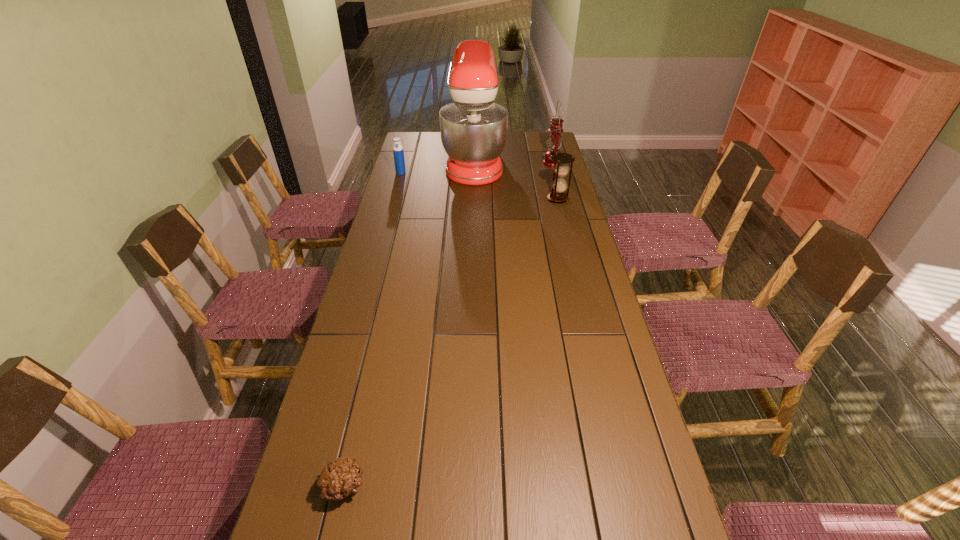
You are a GUI agent. You are given a task and a screenshot of the screen. Output one action in this format:
    pyautogui.click(x=<x>, y=<y>)
    Task: Click on the vacant space located 0.350m on the right of the water bottle
    This screenshot has width=960, height=540.
    Given the screenshot: What is the action you would take?
    pyautogui.click(x=476, y=173)

Find the location of `vacant space situated on the right of the muffin`. vacant space situated on the right of the muffin is located at coordinates (456, 487).

Identify the location of object that is at the far edge. The width and height of the screenshot is (960, 540). (473, 128).

You are a GUI agent. You are given a task and a screenshot of the screen. Output one action in this format:
    pyautogui.click(x=<x>, y=<y>)
    Task: Click on the water bottle positioned at the left edge
    
    Given the screenshot: What is the action you would take?
    pyautogui.click(x=398, y=152)

Find the location of `muffin located in the left edge section of the desktop`. muffin located in the left edge section of the desktop is located at coordinates (340, 478).

Image resolution: width=960 pixels, height=540 pixels. I want to click on oil lamp located at the right edge, so click(555, 139).

Where is `hourglass that is at the right edge`? hourglass that is at the right edge is located at coordinates 559,185.

Where is `vacant space at the left edge of the desktop`? The height and width of the screenshot is (540, 960). vacant space at the left edge of the desktop is located at coordinates (411, 200).

You are a GUI agent. You are given a task and a screenshot of the screen. Output one action in this format:
    pyautogui.click(x=<x>, y=<y>)
    Task: Click on the vacant region at the right edge of the desktop
    The image size is (960, 540).
    Given the screenshot: What is the action you would take?
    pyautogui.click(x=578, y=211)

Identify the location of vacant space at the far right corner of the desktop. pyautogui.click(x=544, y=142).